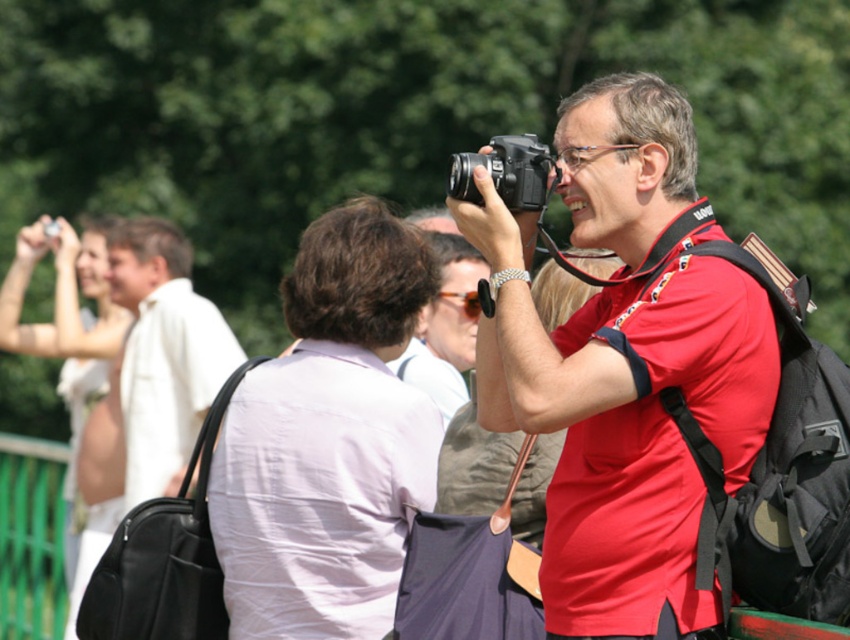
Question: Estimate the real-world distances between objects in this image. Which object is farther from the pink fabric shirt at center?

Choices:
 (A) black plastic camera at center
 (B) matte black camera at center

Answer: (B)

Question: Does matte black camera at upper right have a lesser width compared to black plastic camera at center?

Choices:
 (A) no
 (B) yes

Answer: (A)

Question: Which point is closer to the camera?

Choices:
 (A) (420, 372)
 (B) (370, 292)
 (C) (154, 307)

Answer: (B)

Question: Is matte black camera at center closer to the viewer compared to white fabric purse at left?

Choices:
 (A) no
 (B) yes

Answer: (B)

Question: Which object is positioned farthest from the matte black camera at center?

Choices:
 (A) white matte shirt at upper left
 (B) white fabric purse at left
 (C) matte black camera at upper right

Answer: (B)

Question: Can you confirm if pink fabric shirt at center is positioned to the left of white fabric purse at left?

Choices:
 (A) yes
 (B) no

Answer: (B)